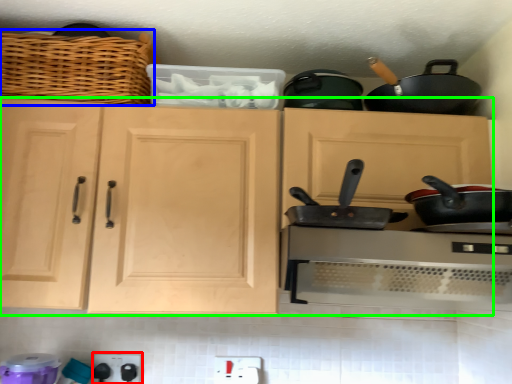
Question: Which object is the farthest from appliance (highlighted by a red box)? Choose among these: basket (highlighted by a blue box) or cabinetry (highlighted by a green box).

Choices:
 (A) basket
 (B) cabinetry

Answer: (A)